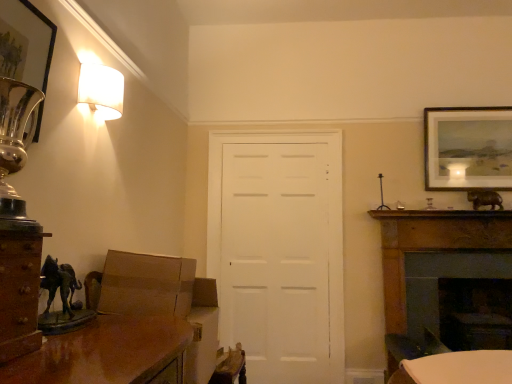
Image resolution: width=512 pixels, height=384 pixels. What are the coordinates of `vacant point above white matte door at center (from a real-world perspective)` in the screenshot? It's located at [272, 132].